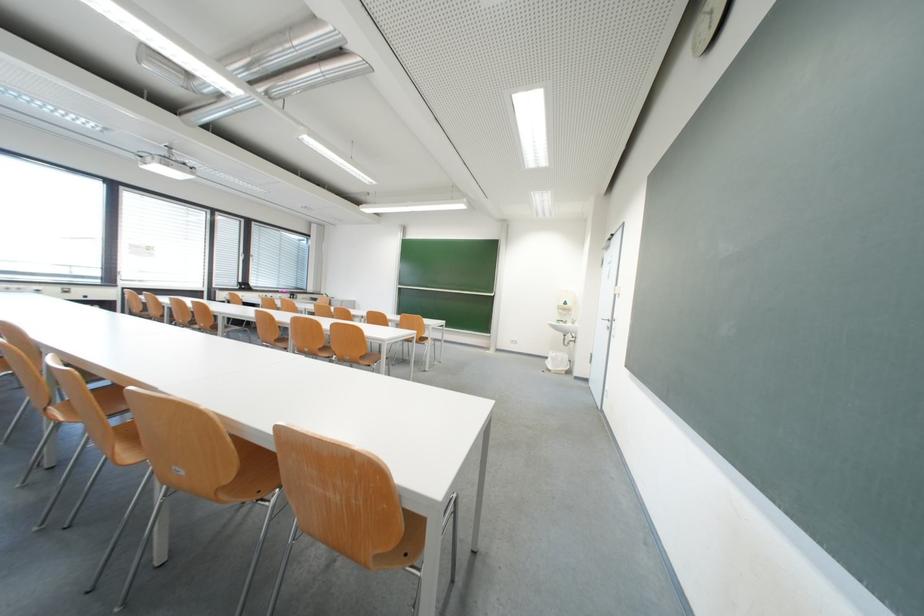
The height and width of the screenshot is (616, 924). What are the coordinates of `silver door handle` in the screenshot? It's located at (611, 323).